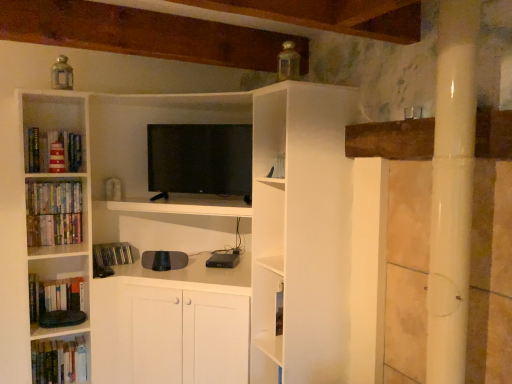
Question: Is point (37, 304) closer or farther from the camera than point (34, 203)?

Choices:
 (A) closer
 (B) farther

Answer: (B)

Question: From a real-world perspective, is hardcover books at lower left, which ranks as the 5th book in top-to-bottom order, physically located above or below hardcover books at left, which appears as the second book when viewed from the top?

Choices:
 (A) above
 (B) below

Answer: (B)

Question: Estimate the real-world distances between objects in this image. Which object is farther from the flat screen tv at center?

Choices:
 (A) hardcover books at left, which appears as the second book when viewed from the top
 (B) hardcover books at left, the first book ordered from the bottom
 (C) red striped lighthouse at left, which is the sixth book from bottom to top
 (D) matte black cd case at lower left, the 4th book viewed from the top
 (E) hardcover books at lower left, which is the 2th book from bottom to top

Answer: (B)

Question: Based on their relative distances, which object is farther from the matte black cd case at lower left, the 4th book viewed from the top?

Choices:
 (A) hardcover books at left, the 6th book positioned from the top
 (B) hardcover books at left, the 3th book from the top
 (C) flat screen tv at center
 (D) hardcover books at lower left, which is the 2th book from bottom to top
 (E) red striped lighthouse at left, which is the sixth book from bottom to top

Answer: (C)